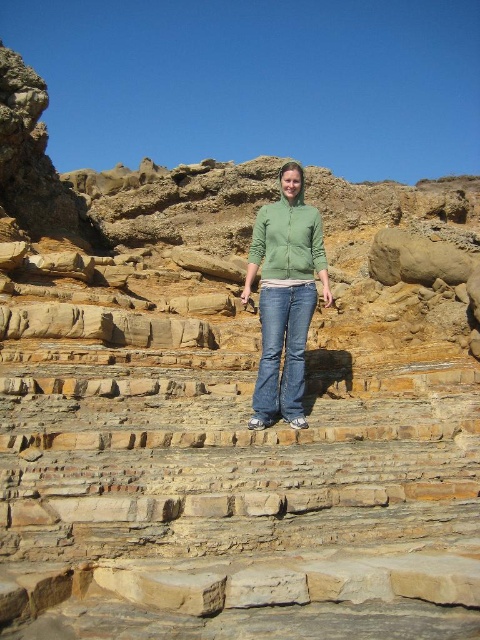
You are a hiker trying to navigate the rocky terrain. You see two points marked on the map as point [268,365] and point [292,349]. Which point should you head towards if you want to reach the one that is closer to the camera?

Point [268,365] is in front of point [292,349], so you should head towards point [268,365] since it is closer to the camera.

You are a photographer trying to capture the person in the image. Since you want to focus on their clothing, you need to ensure that the green matte hoodie at center and blue denim jeans at center are both visible. Given their sizes, which clothing item will take up more space in your photo?

The green matte hoodie at center is bigger than the blue denim jeans at center, so it will take up more space in the photo.